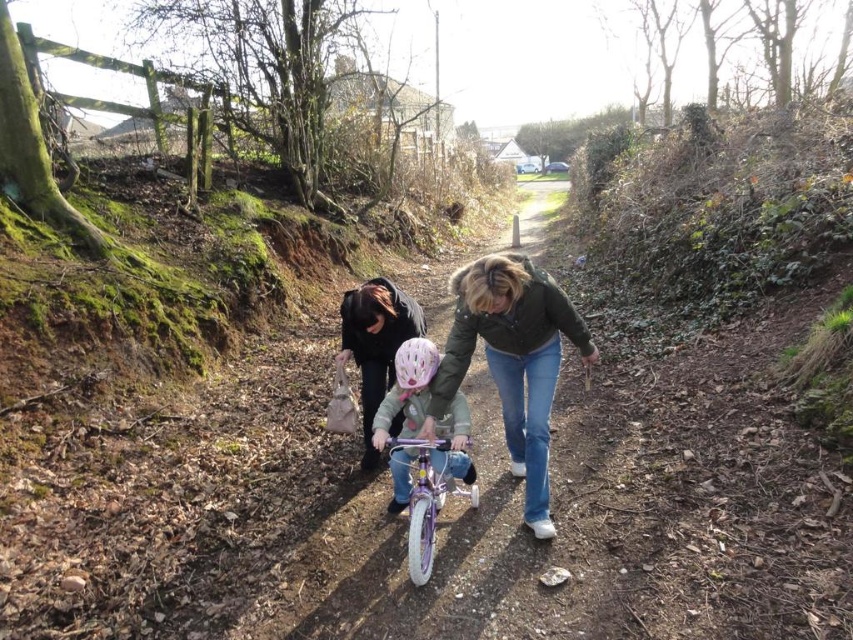
Is green matte jacket at center further to camera compared to matte black jacket at center?

No, it is in front of matte black jacket at center.

What do you see at coordinates (512, 360) in the screenshot?
I see `green matte jacket at center` at bounding box center [512, 360].

I want to click on green matte jacket at center, so click(x=512, y=360).

Looking at this image, which is below, pink matte helmet at center or purple metallic bicycle at center?

purple metallic bicycle at center

How much distance is there between pink matte helmet at center and purple metallic bicycle at center?

The distance of pink matte helmet at center from purple metallic bicycle at center is 4.52 inches.

Locate an element on the screen. The width and height of the screenshot is (853, 640). pink matte helmet at center is located at coordinates tap(407, 392).

Does green matte jacket at center have a greater height compared to pink matte helmet at center?

Correct, green matte jacket at center is much taller as pink matte helmet at center.

Is green matte jacket at center in front of pink matte helmet at center?

Yes, green matte jacket at center is in front of pink matte helmet at center.

Is point (526, 284) less distant than point (428, 369)?

Yes.

At what (x,y) coordinates should I click in order to perform the action: click on green matte jacket at center. Please return your answer as a coordinate pair (x, y). The height and width of the screenshot is (640, 853). Looking at the image, I should click on (512, 360).